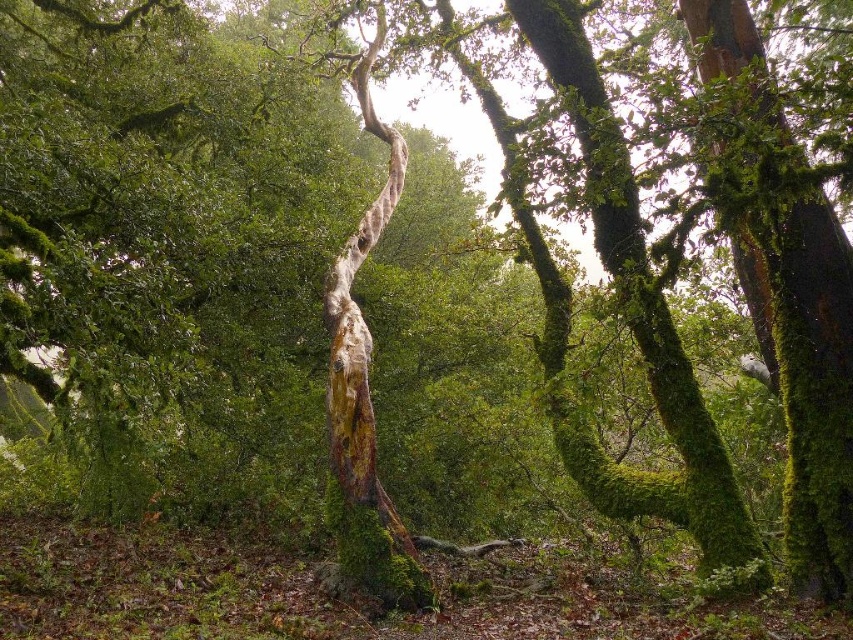
You are a hiker trying to navigate through the forest and need to identify the bigger tree trunk to mark your path. Which one is larger between the green mossy tree trunk at right and the green mossy tree trunk at upper right?

The green mossy tree trunk at right is larger in size compared to the green mossy tree trunk at upper right, so you should mark the green mossy tree trunk at right as the bigger one for your path.

Based on the photo, you are a hiker in the forest and see two green mossy tree trunks. One is labeled as green mossy tree trunk at right and the other as green mossy tree trunk at upper right. Which one is positioned more to the east if you are facing north?

The green mossy tree trunk at right is to the right of the green mossy tree trunk at upper right. Since you are facing north, your right side points east. Therefore, the green mossy tree trunk at right is positioned more to the east compared to the green mossy tree trunk at upper right.

You are a hiker who has just entered the forest and sees the point marked at coordinates (795, 307). Based on the scene description, what object does this point likely belong to?

The point at coordinates (795, 307) corresponds to the green mossy tree trunk at right.